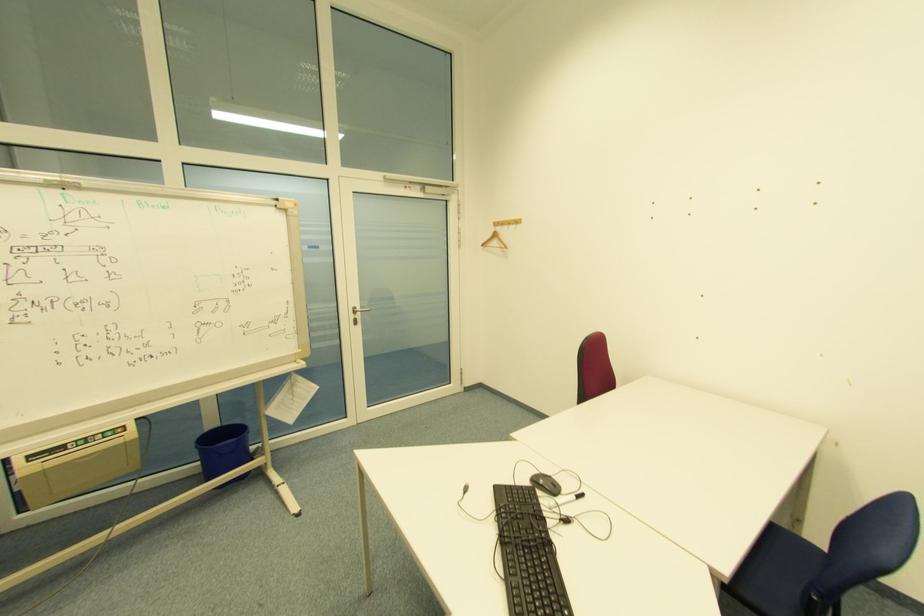
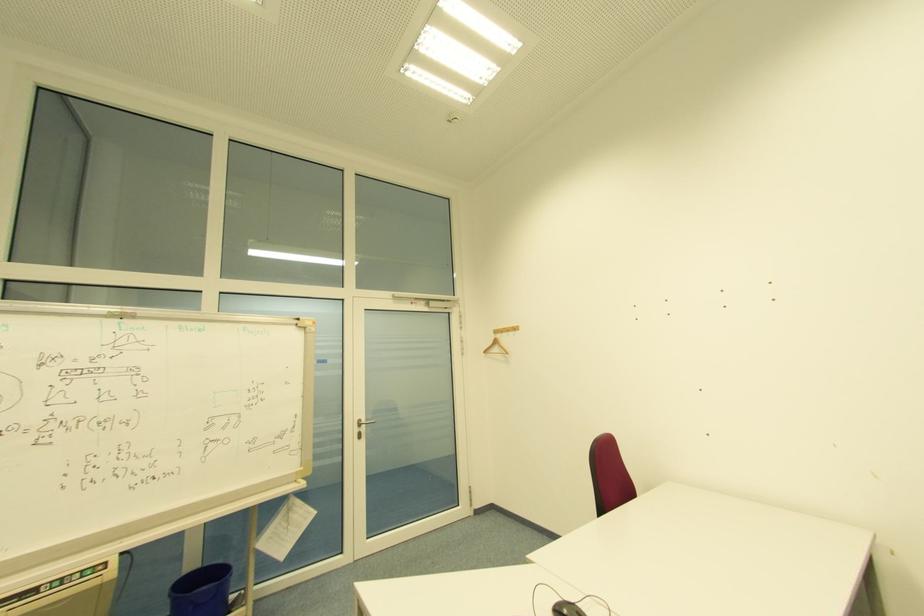
Question: How did the camera likely rotate?

Choices:
 (A) Left
 (B) Right
 (C) Up
 (D) Down

Answer: (C)